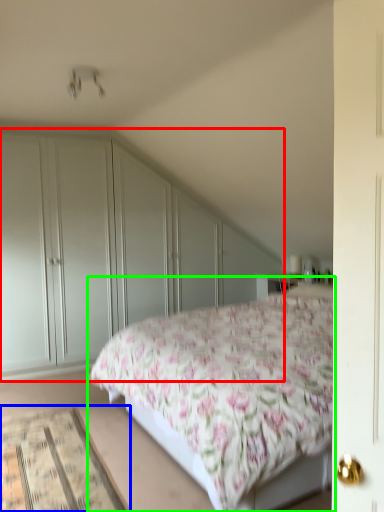
Question: Which object is the farthest from dresser (highlighted by a red box)? Choose among these: mat (highlighted by a blue box) or bed (highlighted by a green box).

Choices:
 (A) mat
 (B) bed

Answer: (A)